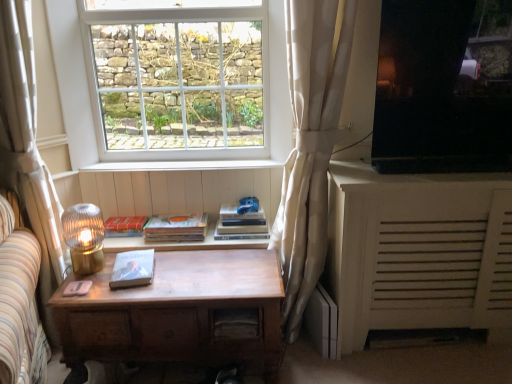
What are the coordinates of `free location above matte red paperback book at center, which is counted as the 1th paperback book, starting from the back (from a real-world perspective)` in the screenshot? It's located at (121, 221).